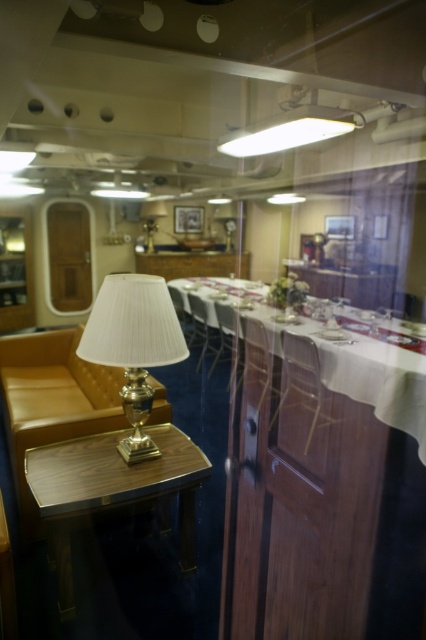
Does silver metallic table lamp at left have a greater width compared to brown leather armchair at center?

Indeed, silver metallic table lamp at left has a greater width compared to brown leather armchair at center.

Between silver metallic table lamp at left and brown leather armchair at center, which one is positioned higher?

brown leather armchair at center

Who is more forward, (141,394) or (227,326)?

Point (141,394) is in front.

I want to click on silver metallic table lamp at left, so click(x=134, y=346).

Between point (54, 540) and point (85, 355), which one is positioned behind?

The point (54, 540) is more distant.

From the picture: Is woodenwoodentable at lower left to the right of silver metallic table lamp at left from the viewer's perspective?

Incorrect, woodenwoodentable at lower left is not on the right side of silver metallic table lamp at left.

Is point (57, 445) behind point (137, 420)?

Yes, it is behind point (137, 420).

Identify the location of woodenwoodentable at lower left. This screenshot has height=640, width=426. (111, 488).

In the scene shown: Does white cloth at center have a lesser width compared to wooden chair at center?

In fact, white cloth at center might be wider than wooden chair at center.

Is white cloth at center further to the viewer compared to wooden chair at center?

No.

Is point (402, 355) positioned behind point (255, 368)?

No.

Find the location of a particular element. The image size is (426, 640). white cloth at center is located at coordinates (362, 371).